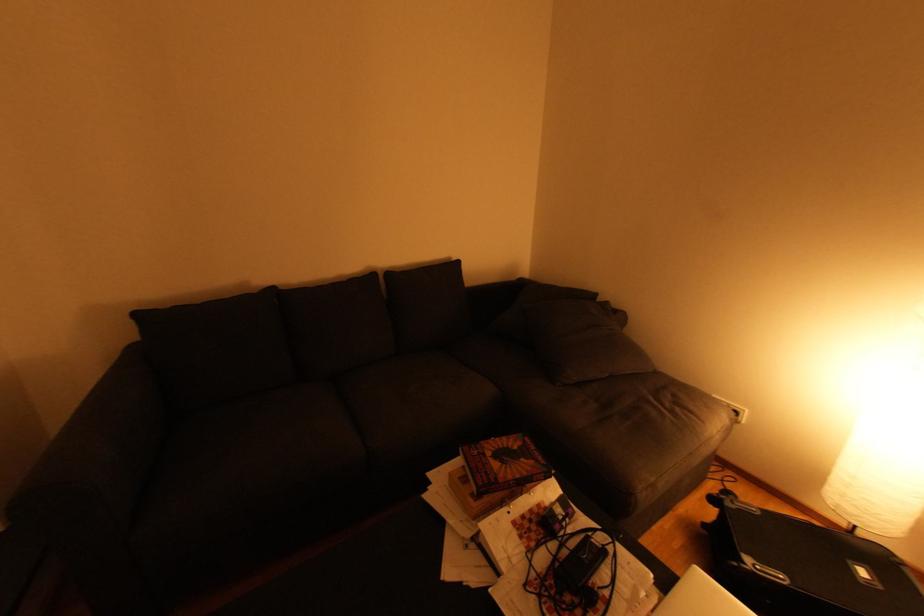
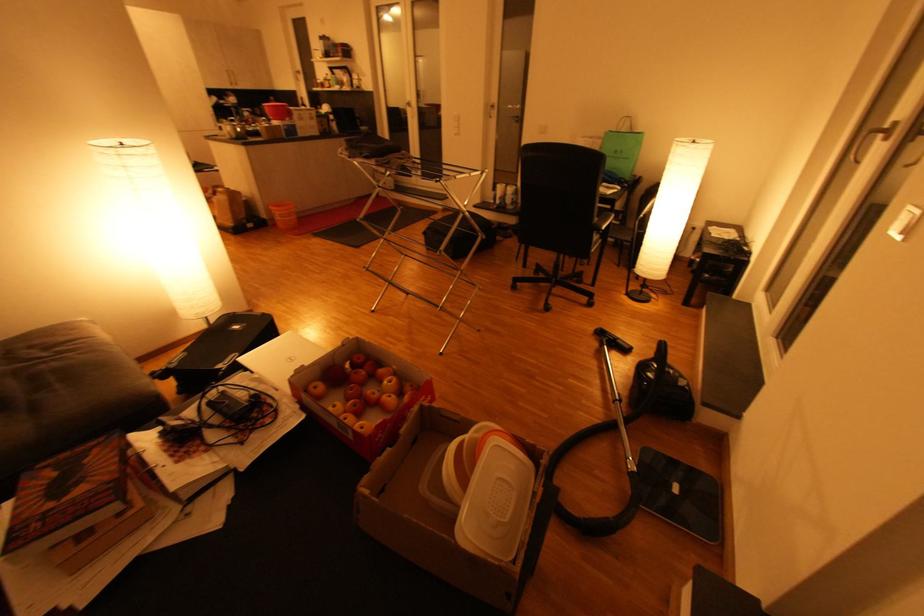
Locate, in the second image, the point that corresponds to the point at 787,581 in the first image.

(238, 357)